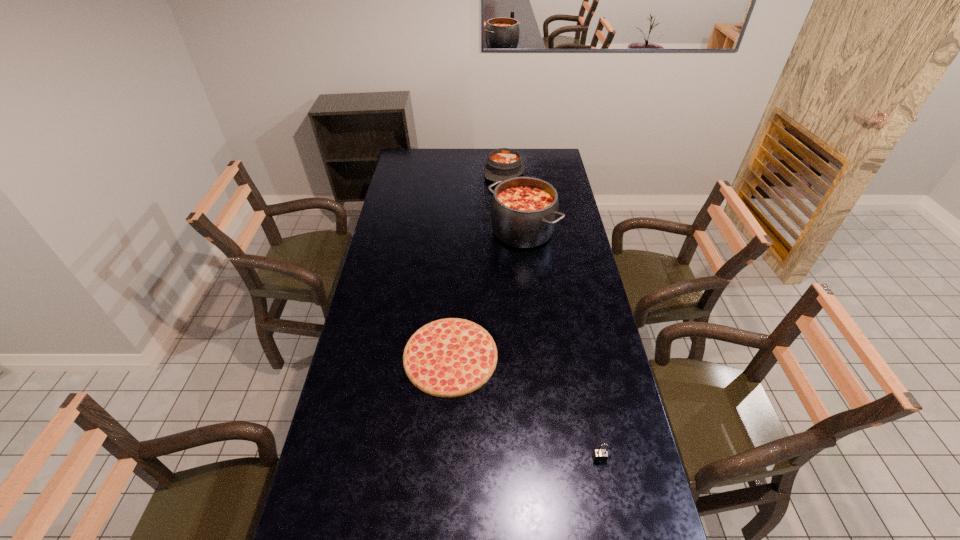
Find the location of a particular element. The height and width of the screenshot is (540, 960). vacant space that's between the nearer casserole and the nearest object is located at coordinates (561, 345).

You are a GUI agent. You are given a task and a screenshot of the screen. Output one action in this format:
    pyautogui.click(x=<x>, y=<y>)
    Task: Click on the free area in between the nearest object and the tallest object
    
    Given the screenshot: What is the action you would take?
    pyautogui.click(x=561, y=345)

Identify the location of vacant space that is in between the padlock and the third nearest object. This screenshot has height=540, width=960. (561, 345).

Where is `free space between the second nearest object and the shorter casserole`? This screenshot has height=540, width=960. free space between the second nearest object and the shorter casserole is located at coordinates (477, 264).

The image size is (960, 540). Find the location of `object that is the second closest to the farther casserole`. object that is the second closest to the farther casserole is located at coordinates (451, 357).

Point out which object is positioned as the second nearest to the padlock. Please provide its 2D coordinates. Your answer should be formatted as a tuple, i.e. [(x, y)], where the tuple contains the x and y coordinates of a point satisfying the conditions above.

[(524, 210)]

At what (x,y) coordinates should I click in order to perform the action: click on vacant region that satisfies the following two spatial constraints: 1. on the front side of the tallest object; 2. on the right side of the shorter casserole. Please return your answer as a coordinate pair (x, y). The image size is (960, 540). Looking at the image, I should click on [x=509, y=231].